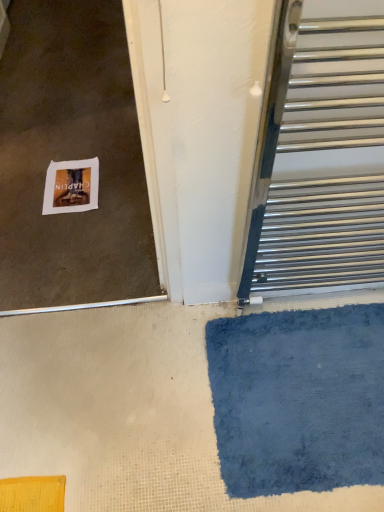
This screenshot has height=512, width=384. I want to click on empty space that is to the right of white paper at lower left, so click(x=125, y=203).